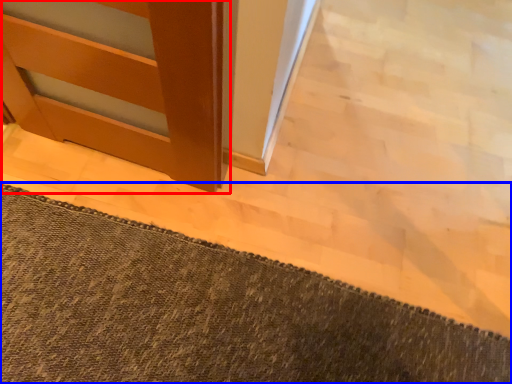
Question: Which object appears closest to the camera in this image, door (highlighted by a red box) or bath mat (highlighted by a blue box)?

Choices:
 (A) door
 (B) bath mat

Answer: (A)